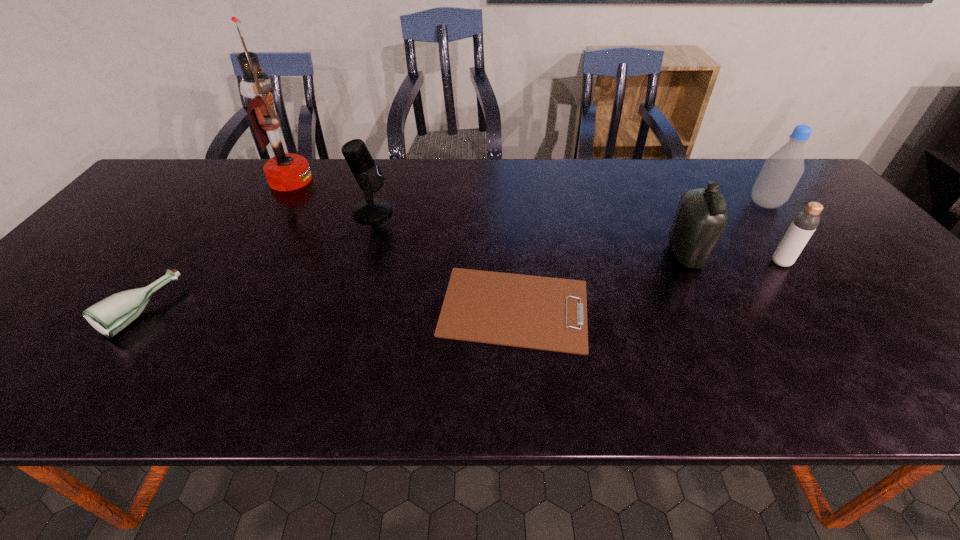
At what (x,y) coordinates should I click in order to perform the action: click on object that is the sixth nearest to the second bottle from left to right. Please return your answer as a coordinate pair (x, y). Image resolution: width=960 pixels, height=540 pixels. Looking at the image, I should click on (109, 316).

Locate which bottle ranks second in proximity to the tallest object. Please provide its 2D coordinates. Your answer should be formatted as a tuple, i.e. [(x, y)], where the tuple contains the x and y coordinates of a point satisfying the conditions above.

[(700, 219)]

Point out which bottle is positioned as the third nearest to the third object from right to left. Please provide its 2D coordinates. Your answer should be formatted as a tuple, i.e. [(x, y)], where the tuple contains the x and y coordinates of a point satisfying the conditions above.

[(109, 316)]

Locate an element on the screen. The height and width of the screenshot is (540, 960). free space that satisfies the following two spatial constraints: 1. on the back side of the sixth tallest object; 2. on the left side of the sixth object from left to right is located at coordinates (177, 262).

The width and height of the screenshot is (960, 540). What are the coordinates of `vacant point that satisfies the following two spatial constraints: 1. on the back side of the shortest object; 2. on the right side of the third object from right to left` in the screenshot? It's located at (511, 255).

Locate an element on the screen. Image resolution: width=960 pixels, height=540 pixels. free space that satisfies the following two spatial constraints: 1. on the back side of the fourth object from left to right; 2. on the right side of the second shortest bottle is located at coordinates [x=511, y=262].